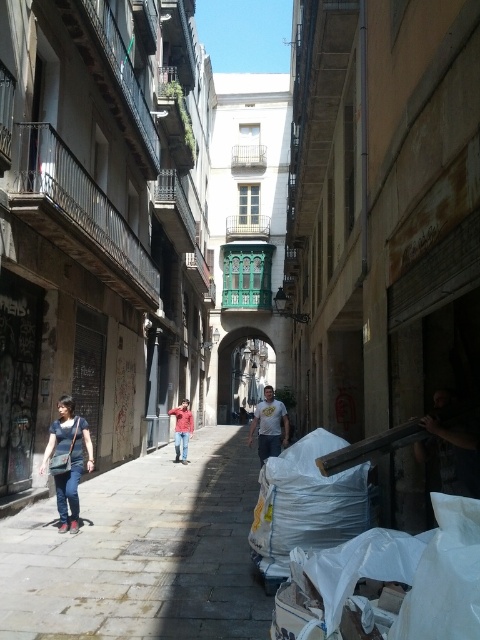
Where is `denim jeans at lower left`? This screenshot has height=640, width=480. denim jeans at lower left is located at coordinates (68, 460).

Does denim jeans at lower left have a larger size compared to red denim jeans at center?

Indeed, denim jeans at lower left has a larger size compared to red denim jeans at center.

This screenshot has height=640, width=480. Describe the element at coordinates (68, 460) in the screenshot. I see `denim jeans at lower left` at that location.

I want to click on denim jeans at lower left, so click(x=68, y=460).

Who is positioned more to the right, denim jeans at lower left or white t-shirt at center?

Positioned to the right is white t-shirt at center.

Between denim jeans at lower left and white t-shirt at center, which one is positioned lower?

white t-shirt at center

Image resolution: width=480 pixels, height=640 pixels. What do you see at coordinates (68, 460) in the screenshot?
I see `denim jeans at lower left` at bounding box center [68, 460].

This screenshot has height=640, width=480. Find the location of `denim jeans at lower left`. denim jeans at lower left is located at coordinates (68, 460).

Can you confirm if gray stone pavement at center is smaller than denim jeans at lower left?

Actually, gray stone pavement at center might be larger than denim jeans at lower left.

Can you confirm if gray stone pavement at center is positioned to the left of denim jeans at lower left?

Incorrect, gray stone pavement at center is not on the left side of denim jeans at lower left.

Which is behind, point (63, 604) or point (59, 413)?

The point (59, 413) is behind.

Find the location of a particular element. gray stone pavement at center is located at coordinates (142, 552).